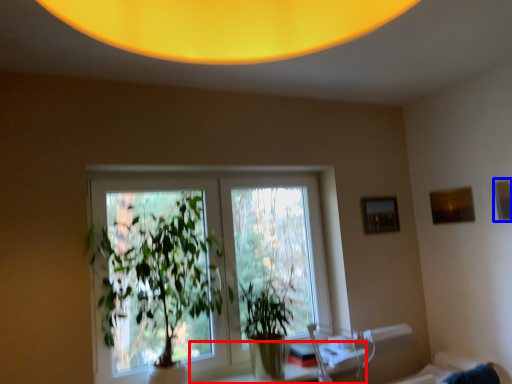
Question: Which object appears closest to the camera in this image, table (highlighted by a red box) or picture frame (highlighted by a blue box)?

Choices:
 (A) table
 (B) picture frame

Answer: (A)